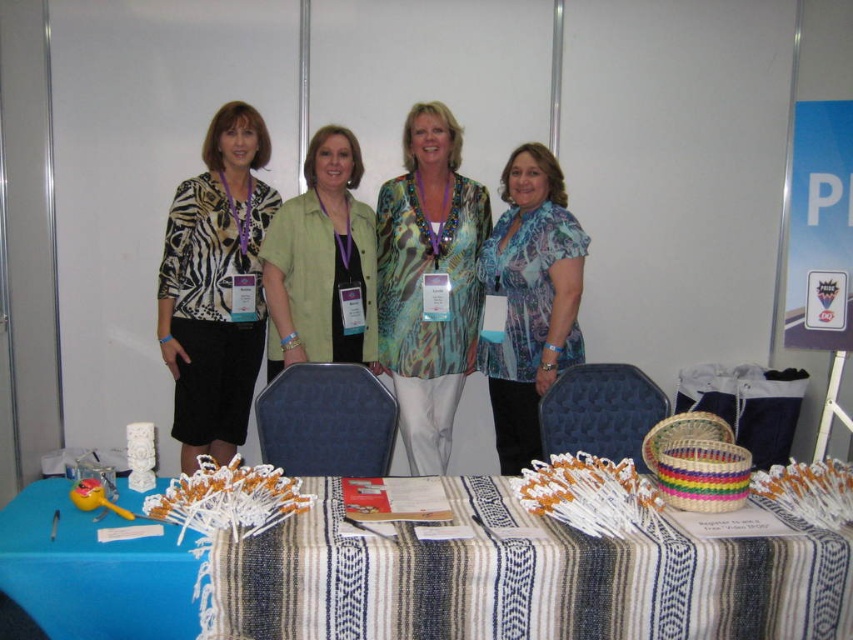
Question: Can you confirm if blue striped tablecloth at center is wider than zebra print blouse at center?

Choices:
 (A) yes
 (B) no

Answer: (A)

Question: Is the position of blue striped tablecloth at center more distant than that of green matte shirt at center?

Choices:
 (A) no
 (B) yes

Answer: (A)

Question: Considering the real-world distances, which object is farthest from the printed silk blouse at center?

Choices:
 (A) blue striped tablecloth at center
 (B) blue sheer blouse at center
 (C) zebra print blouse at center

Answer: (A)

Question: Which object appears closest to the camera in this image?

Choices:
 (A) printed silk blouse at center
 (B) green matte shirt at center

Answer: (B)

Question: Which of the following is the farthest from the observer?

Choices:
 (A) printed silk blouse at center
 (B) green matte shirt at center

Answer: (A)

Question: Does zebra print blouse at center have a greater width compared to blue sheer blouse at center?

Choices:
 (A) yes
 (B) no

Answer: (A)